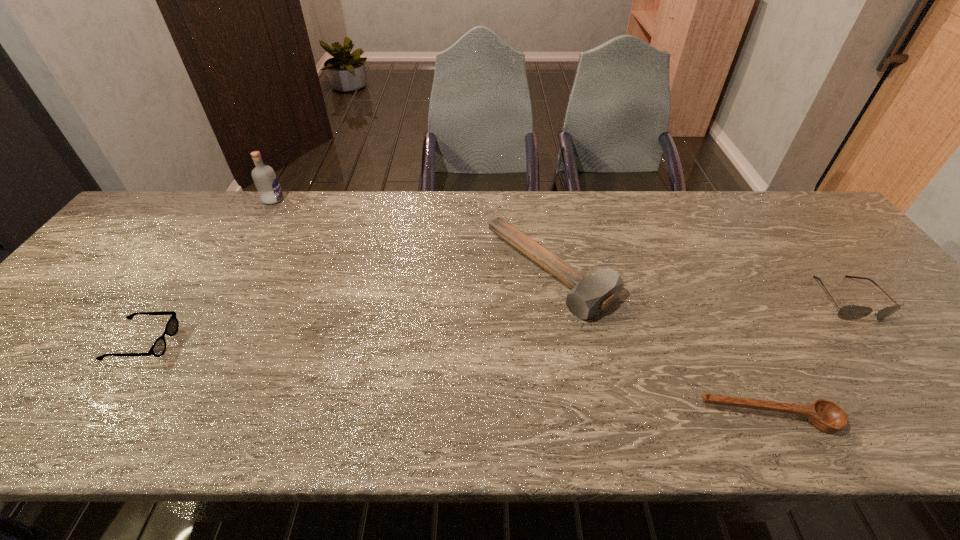
Where is `vacant space at the left edge of the desktop`? vacant space at the left edge of the desktop is located at coordinates (84, 337).

I want to click on vacant region at the right edge of the desktop, so click(x=861, y=265).

Find the location of a particular element. free point at the far left corner is located at coordinates (138, 228).

Locate an element on the screen. This screenshot has height=540, width=960. unoccupied position between the spectacles and the sunglasses is located at coordinates (495, 321).

The image size is (960, 540). Identify the location of free spot between the farthest object and the second object from right to left. (521, 309).

Where is `vacant point located between the mallet and the tallest object`? This screenshot has height=540, width=960. vacant point located between the mallet and the tallest object is located at coordinates (412, 235).

Locate an element on the screen. The image size is (960, 540). vacant area that lies between the sunglasses and the spectacles is located at coordinates (495, 321).

Locate an element on the screen. empty space that is in between the third tallest object and the shortest object is located at coordinates (808, 359).

The width and height of the screenshot is (960, 540). Find the location of `free area in between the leftmost object and the third tallest object`. free area in between the leftmost object and the third tallest object is located at coordinates (495, 321).

You are a GUI agent. You are given a task and a screenshot of the screen. Output one action in this format:
    pyautogui.click(x=<x>, y=<y>)
    Task: Click on the vacant space that is in between the sunglasses and the shortest object
    
    Given the screenshot: What is the action you would take?
    pyautogui.click(x=808, y=359)